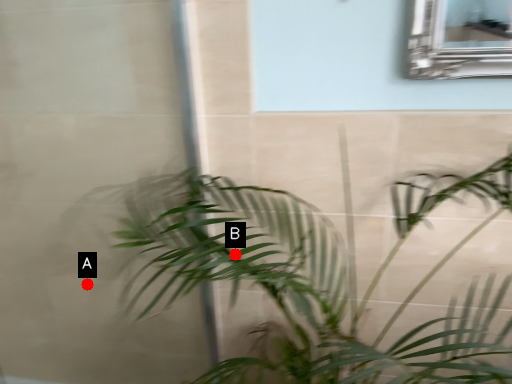
Question: Two points are circled on the image, labeled by A and B beside each circle. Which point is closer to the camera?

Choices:
 (A) A is closer
 (B) B is closer

Answer: (B)